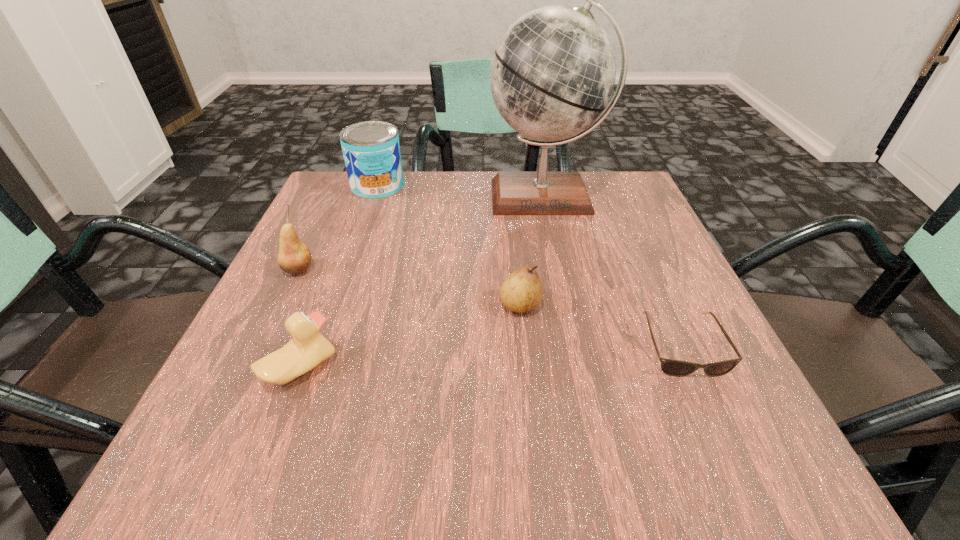
You are a GUI agent. You are given a task and a screenshot of the screen. Output one action in this format:
    pyautogui.click(x=<x>, y=<y>)
    Task: Click on the tallest object
    Image resolution: width=960 pixels, height=540 pixels.
    Given the screenshot: What is the action you would take?
    pyautogui.click(x=553, y=72)

Find the location of a particular element. This screenshot has height=540, width=960. can is located at coordinates (371, 150).

This screenshot has height=540, width=960. What are the coordinates of `the farther pear` in the screenshot? It's located at (294, 257).

At what (x,y) coordinates should I click in order to perform the action: click on the third farthest object. Please return your answer as a coordinate pair (x, y). The height and width of the screenshot is (540, 960). Looking at the image, I should click on (294, 257).

Locate an element on the screen. This screenshot has width=960, height=540. the nearer pear is located at coordinates (522, 291).

Locate an element on the screen. the shorter pear is located at coordinates (522, 291).

Where is `duck`? The width and height of the screenshot is (960, 540). duck is located at coordinates (308, 348).

Locate an element on the screen. This screenshot has height=540, width=960. the shortest object is located at coordinates point(677,368).

This screenshot has width=960, height=540. I want to click on free space located 0.100m at the equator of the globe, so [x=557, y=255].

At what (x,y) coordinates should I click in order to perform the action: click on vacant space located 0.210m on the right of the can. Please return your answer as a coordinate pair (x, y). Image resolution: width=960 pixels, height=540 pixels. Looking at the image, I should click on (490, 186).